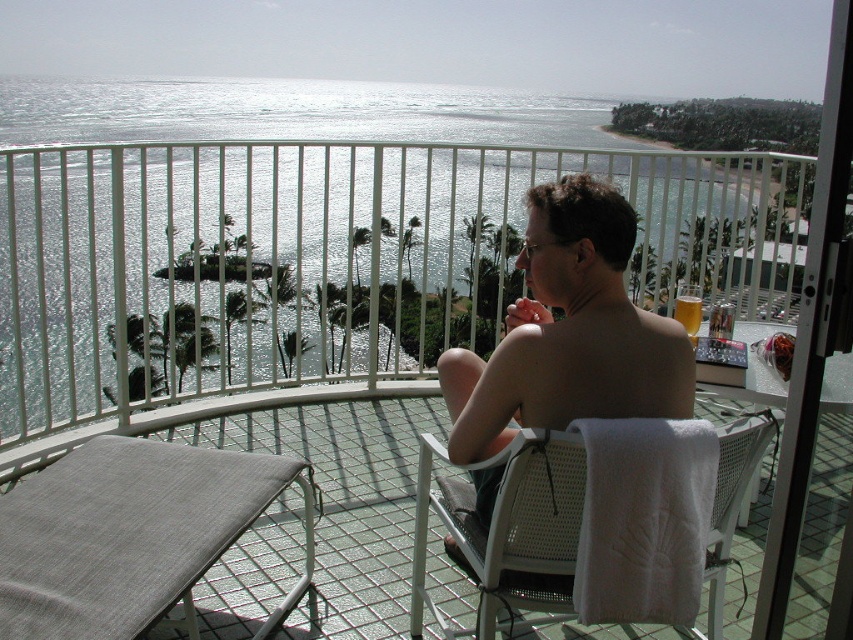
Which is more to the right, shiny silver phone at center or translucent glass beverage at upper right?

translucent glass beverage at upper right

Locate an element on the screen. The height and width of the screenshot is (640, 853). shiny silver phone at center is located at coordinates coord(567,332).

Locate an element on the screen. The height and width of the screenshot is (640, 853). shiny silver phone at center is located at coordinates pyautogui.click(x=567, y=332).

Can you confirm if gray fabric chair at lower left is smaller than shiny silver phone at center?

No, gray fabric chair at lower left is not smaller than shiny silver phone at center.

Is gray fabric chair at lower left wider than shiny silver phone at center?

Indeed, gray fabric chair at lower left has a greater width compared to shiny silver phone at center.

This screenshot has height=640, width=853. I want to click on gray fabric chair at lower left, so click(132, 536).

Between gray fabric chair at lower left and white woven chair at center, which one is positioned higher?

white woven chair at center is above.

At what (x,y) coordinates should I click in order to perform the action: click on gray fabric chair at lower left. Please return your answer as a coordinate pair (x, y). Image resolution: width=853 pixels, height=640 pixels. Looking at the image, I should click on (132, 536).

Identify the location of gray fabric chair at lower left. (132, 536).